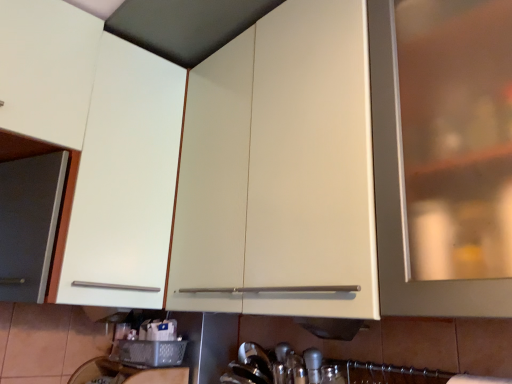
Question: Does matte white cabinet at left, the 1th cabinetry positioned from the left, have a lesser width compared to matte white cabinet at center, the 1th cabinetry positioned from the right?

Choices:
 (A) yes
 (B) no

Answer: (B)

Question: From the image's perspective, would you say matte white cabinet at left, the 2th cabinetry positioned from the right, is shown under matte white cabinet at center, which is the second cabinetry in left-to-right order?

Choices:
 (A) yes
 (B) no

Answer: (A)

Question: Considering the relative positions of matte white cabinet at left, the 1th cabinetry positioned from the left, and matte white cabinet at center, the 1th cabinetry positioned from the right, in the image provided, is matte white cabinet at left, the 1th cabinetry positioned from the left, behind matte white cabinet at center, the 1th cabinetry positioned from the right,?

Choices:
 (A) yes
 (B) no

Answer: (A)

Question: Does matte white cabinet at left, the 1th cabinetry positioned from the left, appear on the left side of matte white cabinet at center, which is the second cabinetry in left-to-right order?

Choices:
 (A) no
 (B) yes

Answer: (B)

Question: Is matte white cabinet at left, the 2th cabinetry positioned from the right, positioned with its back to matte white cabinet at center, which is the second cabinetry in left-to-right order?

Choices:
 (A) no
 (B) yes

Answer: (A)

Question: Does matte white cabinet at left, the 2th cabinetry positioned from the right, have a greater height compared to matte white cabinet at center, the 1th cabinetry positioned from the right?

Choices:
 (A) yes
 (B) no

Answer: (A)

Question: Does matte white cabinet at center, which is the second cabinetry in left-to-right order, appear on the right side of matte white cabinet at left, the 2th cabinetry positioned from the right?

Choices:
 (A) yes
 (B) no

Answer: (A)

Question: Considering the relative sizes of matte white cabinet at center, the 1th cabinetry positioned from the right, and matte white cabinet at left, the 1th cabinetry positioned from the left, in the image provided, is matte white cabinet at center, the 1th cabinetry positioned from the right, smaller than matte white cabinet at left, the 1th cabinetry positioned from the left,?

Choices:
 (A) yes
 (B) no

Answer: (B)

Question: Does matte white cabinet at center, which is the second cabinetry in left-to-right order, have a larger size compared to matte white cabinet at left, the 1th cabinetry positioned from the left?

Choices:
 (A) no
 (B) yes

Answer: (B)

Question: Is matte white cabinet at center, the 1th cabinetry positioned from the right, shorter than matte white cabinet at left, the 2th cabinetry positioned from the right?

Choices:
 (A) yes
 (B) no

Answer: (A)

Question: From the image's perspective, is matte white cabinet at center, the 1th cabinetry positioned from the right, over matte white cabinet at left, the 2th cabinetry positioned from the right?

Choices:
 (A) no
 (B) yes

Answer: (B)

Question: Is matte white cabinet at left, the 1th cabinetry positioned from the left, surrounded by matte white cabinet at center, which is the second cabinetry in left-to-right order?

Choices:
 (A) no
 (B) yes

Answer: (A)

Question: Considering the positions of matte white cabinet at center, which is the second cabinetry in left-to-right order, and matte white cabinet at left, the 1th cabinetry positioned from the left, in the image, is matte white cabinet at center, which is the second cabinetry in left-to-right order, bigger or smaller than matte white cabinet at left, the 1th cabinetry positioned from the left,?

Choices:
 (A) big
 (B) small

Answer: (A)